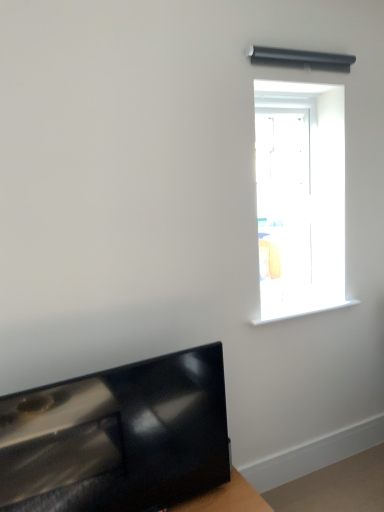
Question: From a real-world perspective, is transparent glass door at upper right physically located above or below white plastic window sill at upper right?

Choices:
 (A) below
 (B) above

Answer: (B)

Question: Visually, is transparent glass door at upper right positioned to the left or to the right of white plastic window sill at upper right?

Choices:
 (A) left
 (B) right

Answer: (A)

Question: Estimate the real-world distances between objects in this image. Which object is farther from the transparent glass door at upper right?

Choices:
 (A) wooden table at lower right
 (B) white plastic window sill at upper right
 (C) glossy black tv at lower left

Answer: (A)

Question: Which object is positioned farthest from the glossy black tv at lower left?

Choices:
 (A) white plastic window sill at upper right
 (B) transparent glass door at upper right
 (C) wooden table at lower right

Answer: (B)